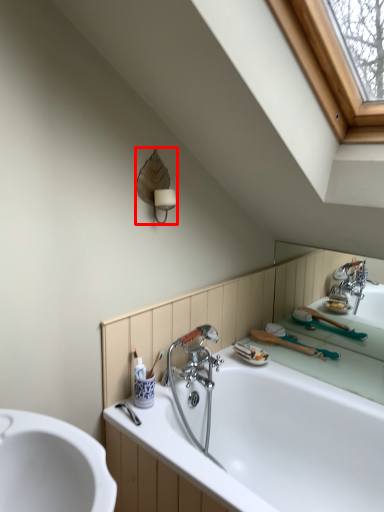
Question: From the image, what is the correct spatial relationship of fixture (annotated by the red box) in relation to bathtub?

Choices:
 (A) right
 (B) left

Answer: (B)